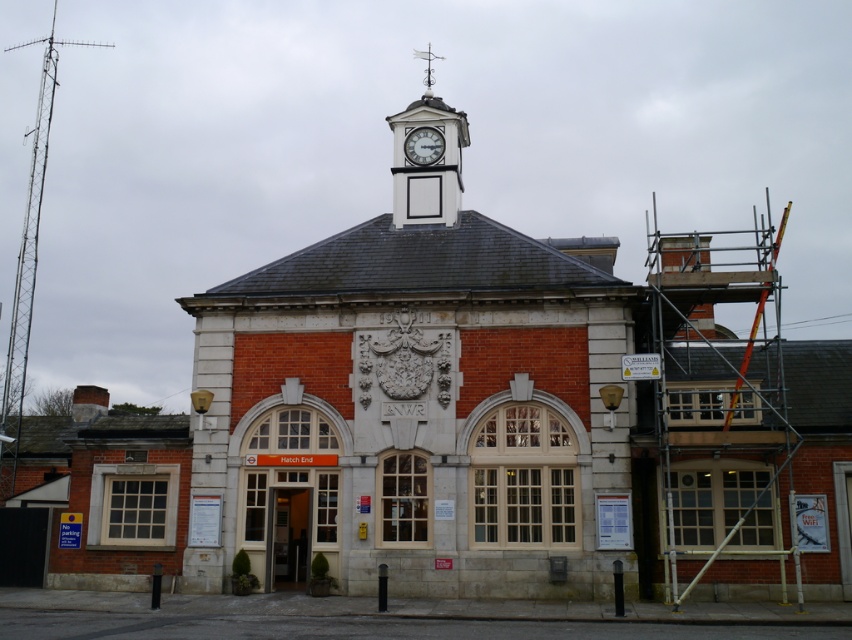
Is white painted wood clock tower at upper center behind white glossy clock at upper center?

No, white painted wood clock tower at upper center is closer to the viewer.

Which of these two, white painted wood clock tower at upper center or white glossy clock at upper center, stands shorter?

white glossy clock at upper center is shorter.

Between point (436, 156) and point (416, 150), which one is positioned in front?

Point (436, 156) is more forward.

Find the location of a particular element. This screenshot has height=640, width=852. white painted wood clock tower at upper center is located at coordinates (427, 157).